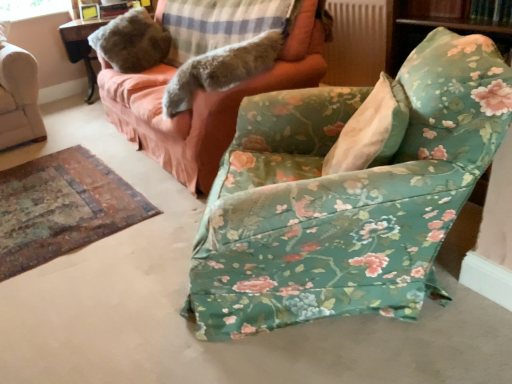
Question: From a real-world perspective, is floral fabric couch at upper center below clear glass window screen at upper left?

Choices:
 (A) yes
 (B) no

Answer: (A)

Question: Can you confirm if floral fabric couch at upper center is smaller than clear glass window screen at upper left?

Choices:
 (A) no
 (B) yes

Answer: (A)

Question: From the image's perspective, is floral fabric couch at upper center on top of clear glass window screen at upper left?

Choices:
 (A) no
 (B) yes

Answer: (A)

Question: Is floral fabric couch at upper center outside clear glass window screen at upper left?

Choices:
 (A) no
 (B) yes

Answer: (B)

Question: Is floral fabric couch at upper center to the left of clear glass window screen at upper left from the viewer's perspective?

Choices:
 (A) yes
 (B) no

Answer: (B)

Question: Based on their sizes in the image, would you say clear glass window screen at upper left is bigger or smaller than fuzzy fabric pillow at upper left, marked as the 1th pillow in a back-to-front arrangement?

Choices:
 (A) big
 (B) small

Answer: (B)

Question: Is clear glass window screen at upper left inside or outside of fuzzy fabric pillow at upper left, placed as the third pillow when sorted from front to back?

Choices:
 (A) inside
 (B) outside

Answer: (B)

Question: Visually, is clear glass window screen at upper left positioned to the left or to the right of fuzzy fabric pillow at upper left, marked as the 1th pillow in a back-to-front arrangement?

Choices:
 (A) right
 (B) left

Answer: (B)

Question: Considering the positions of point (2, 14) and point (139, 54), is point (2, 14) closer or farther from the camera than point (139, 54)?

Choices:
 (A) closer
 (B) farther

Answer: (B)

Question: Is white fabric pillow at center, acting as the first pillow starting from the front, situated inside clear glass window screen at upper left or outside?

Choices:
 (A) inside
 (B) outside

Answer: (B)

Question: Relative to clear glass window screen at upper left, is white fabric pillow at center, the 3th pillow viewed from the back, in front or behind?

Choices:
 (A) front
 (B) behind

Answer: (A)

Question: From a real-world perspective, is white fabric pillow at center, acting as the first pillow starting from the front, positioned above or below clear glass window screen at upper left?

Choices:
 (A) below
 (B) above

Answer: (A)

Question: Is white fabric pillow at center, acting as the first pillow starting from the front, bigger or smaller than clear glass window screen at upper left?

Choices:
 (A) big
 (B) small

Answer: (A)

Question: Is floral fabric chair at center situated inside fuzzy fabric pillow at upper left, placed as the third pillow when sorted from front to back, or outside?

Choices:
 (A) outside
 (B) inside

Answer: (A)

Question: Relative to fuzzy fabric pillow at upper left, placed as the third pillow when sorted from front to back, is floral fabric chair at center in front or behind?

Choices:
 (A) behind
 (B) front

Answer: (B)